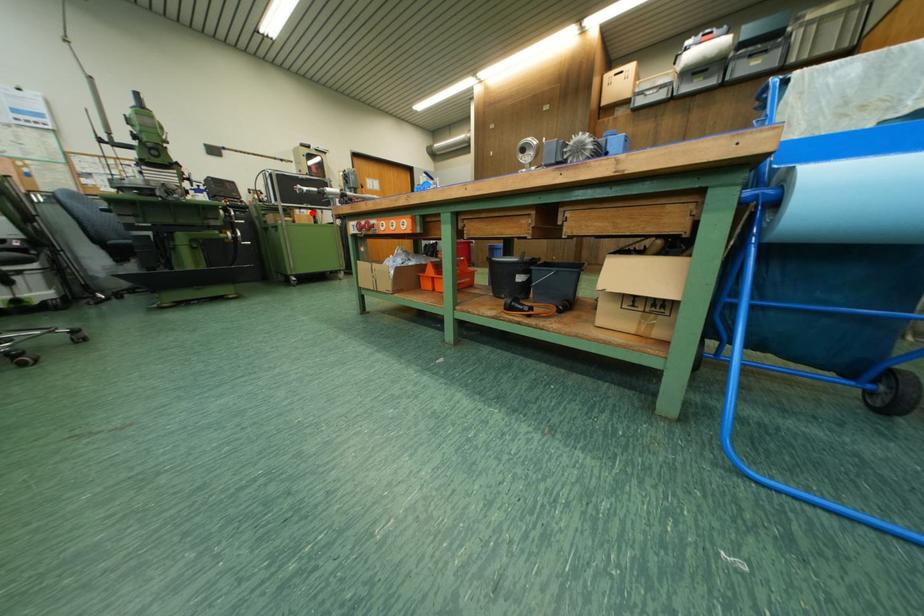
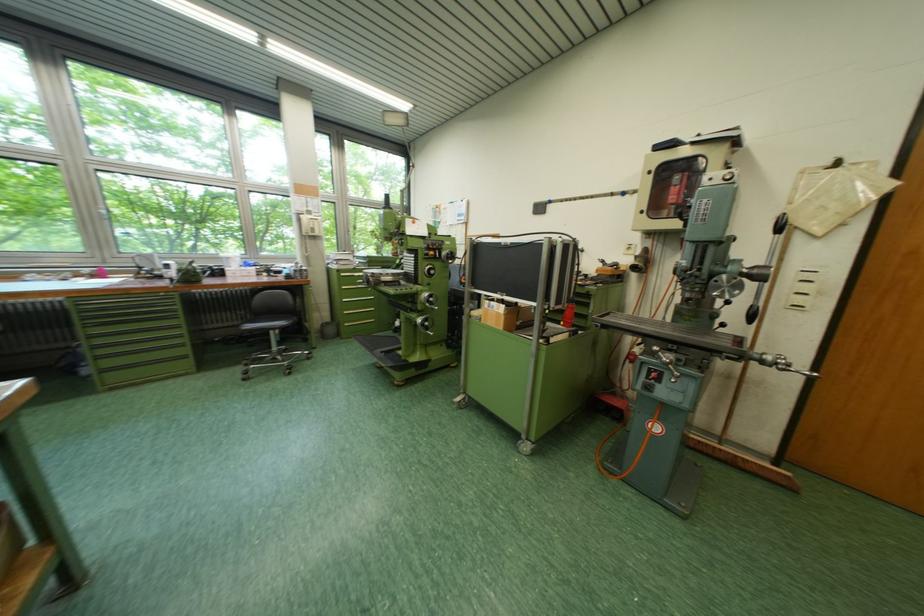
Where in the second image is the point corresponding to the highlighted location from the first image?

(503, 305)